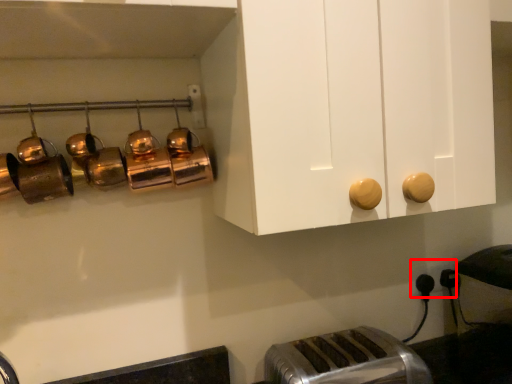
Question: From the image's perspective, where is electric outlet (annotated by the red box) located relative to toaster?

Choices:
 (A) above
 (B) below

Answer: (A)